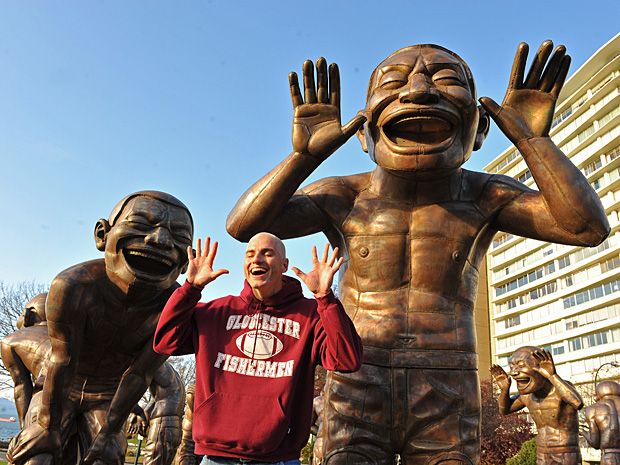
What are the coordinates of `statue` in the screenshot? It's located at click(422, 279), click(90, 321), click(542, 407), click(604, 424), click(33, 327).